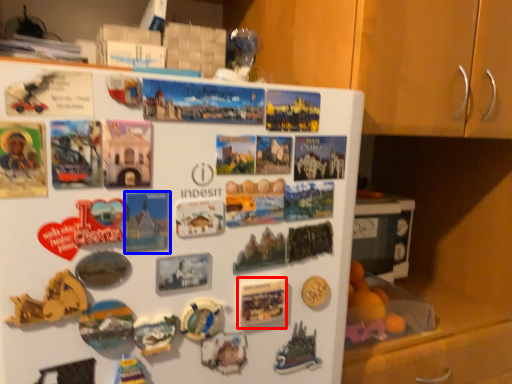
Question: Which object appears farthest to the camera in this image, postcard (highlighted by a red box) or postcard (highlighted by a blue box)?

Choices:
 (A) postcard
 (B) postcard

Answer: (A)